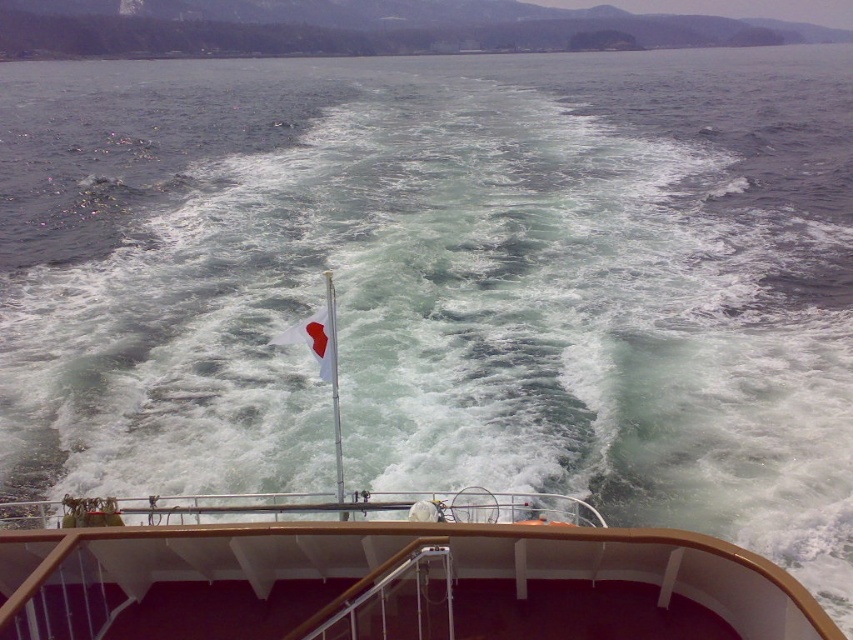
Which is behind, point (144, 602) or point (314, 344)?

Point (314, 344)

Between point (662, 627) and point (309, 339), which one is positioned behind?

Point (309, 339)

Find the location of `brown polished wood deck at lower center`. brown polished wood deck at lower center is located at coordinates (393, 582).

Which is in front, point (682, 576) or point (334, 310)?

Point (682, 576)

Between point (61, 632) and point (332, 282), which one is positioned behind?

The point (332, 282) is more distant.

What are the coordinates of `brown polished wood deck at lower center` in the screenshot? It's located at (393, 582).

The height and width of the screenshot is (640, 853). I want to click on brown polished wood deck at lower center, so click(x=393, y=582).

Does white fabric flag at center have a larger size compared to white plastic flagpole at center?

Actually, white fabric flag at center might be smaller than white plastic flagpole at center.

Who is more distant from viewer, (323, 356) or (340, 481)?

Point (340, 481)

You are a GUI agent. You are given a task and a screenshot of the screen. Output one action in this format:
    pyautogui.click(x=<x>, y=<y>)
    Task: Click on the white fabric flag at center
    The height and width of the screenshot is (640, 853).
    Given the screenshot: What is the action you would take?
    pyautogui.click(x=315, y=340)